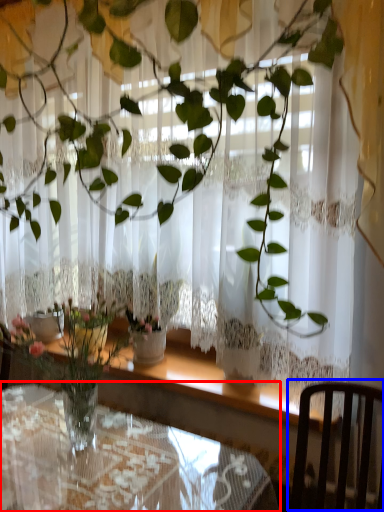
Question: Which object appears closest to the camera in this image, table (highlighted by a red box) or chair (highlighted by a blue box)?

Choices:
 (A) table
 (B) chair

Answer: (B)